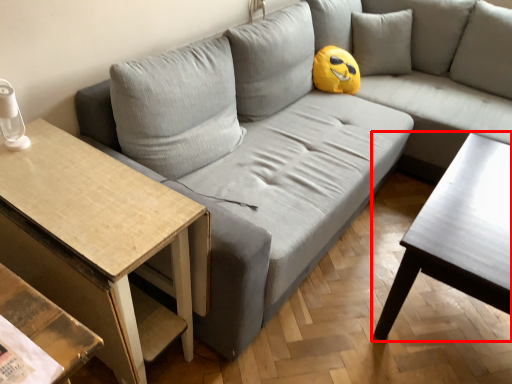
Question: In this image, where is coffee table (annotated by the red box) located relative to table?

Choices:
 (A) right
 (B) left

Answer: (A)